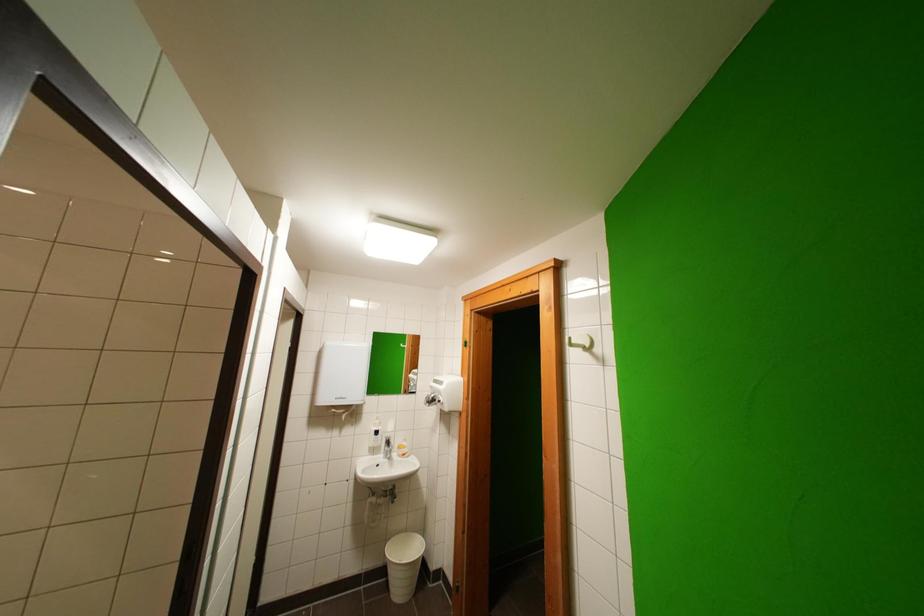
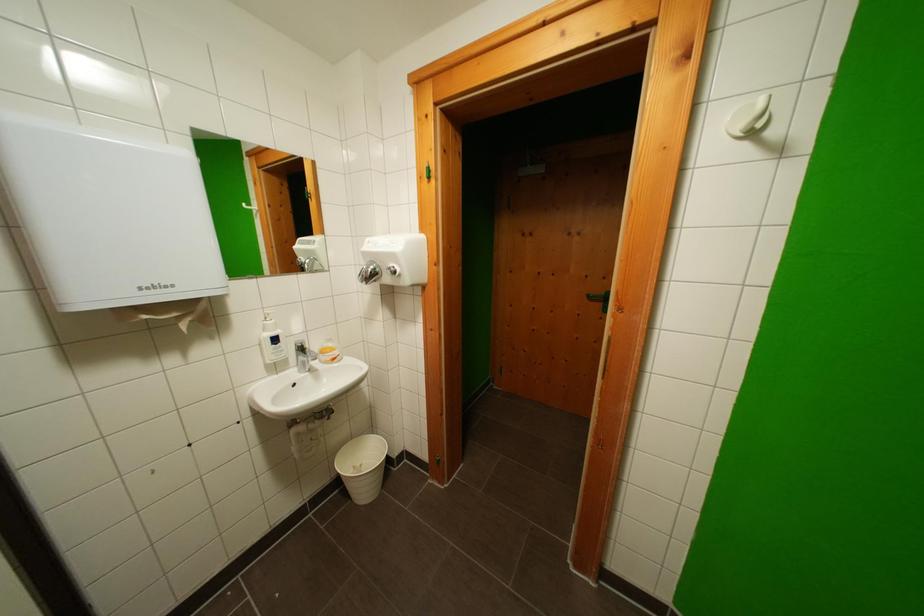
The first image is from the beginning of the video and the second image is from the end. How did the camera likely rotate when shooting the video?

The camera rotated toward right-down.